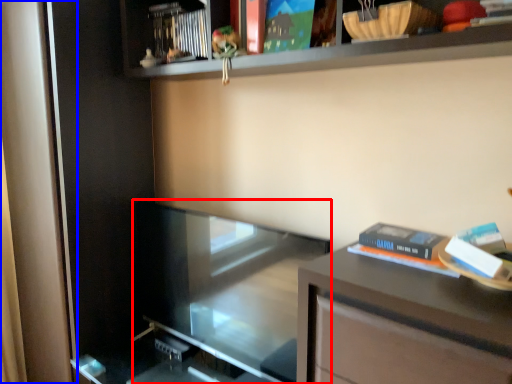
Question: Which point is further to the camera, glass door (highlighted by a red box) or screen door (highlighted by a blue box)?

Choices:
 (A) glass door
 (B) screen door

Answer: (B)